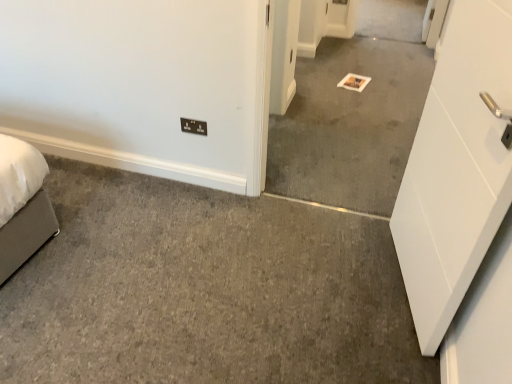
Question: From the image's perspective, is black plastic/light switch at lower center over gray carpet at center?

Choices:
 (A) yes
 (B) no

Answer: (B)

Question: Is the depth of black plastic/light switch at lower center greater than that of gray carpet at center?

Choices:
 (A) yes
 (B) no

Answer: (A)

Question: Is black plastic/light switch at lower center thinner than gray carpet at center?

Choices:
 (A) yes
 (B) no

Answer: (A)

Question: Is black plastic/light switch at lower center wider than gray carpet at center?

Choices:
 (A) yes
 (B) no

Answer: (B)

Question: Is the position of black plastic/light switch at lower center less distant than that of gray carpet at center?

Choices:
 (A) no
 (B) yes

Answer: (A)

Question: Considering the relative sizes of black plastic/light switch at lower center and gray carpet at center in the image provided, is black plastic/light switch at lower center smaller than gray carpet at center?

Choices:
 (A) yes
 (B) no

Answer: (A)

Question: Is there a large distance between gray carpet at center and black plastic/light switch at lower center?

Choices:
 (A) yes
 (B) no

Answer: (A)

Question: From the image's perspective, is gray carpet at center below black plastic/light switch at lower center?

Choices:
 (A) yes
 (B) no

Answer: (B)

Question: From a real-world perspective, is gray carpet at center on black plastic/light switch at lower center?

Choices:
 (A) yes
 (B) no

Answer: (A)

Question: Is gray carpet at center located outside black plastic/light switch at lower center?

Choices:
 (A) yes
 (B) no

Answer: (A)

Question: Considering the relative sizes of gray carpet at center and black plastic/light switch at lower center in the image provided, is gray carpet at center shorter than black plastic/light switch at lower center?

Choices:
 (A) yes
 (B) no

Answer: (B)

Question: Is gray carpet at center facing away from black plastic/light switch at lower center?

Choices:
 (A) no
 (B) yes

Answer: (A)

Question: Considering the positions of point tap(397, 155) and point tap(198, 122), is point tap(397, 155) closer or farther from the camera than point tap(198, 122)?

Choices:
 (A) farther
 (B) closer

Answer: (A)